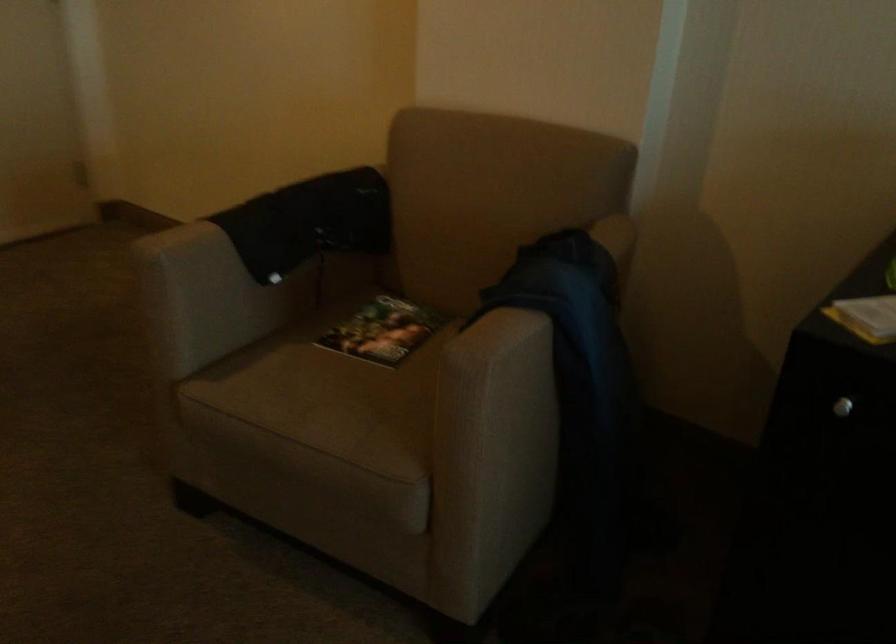
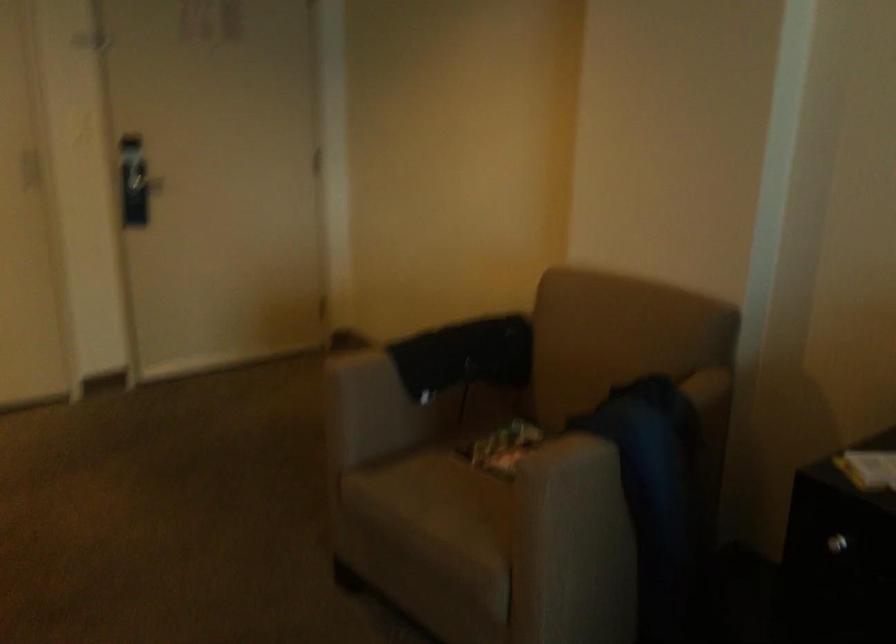
Find the pixel in the second image that matches [528,303] in the first image.

(597, 433)